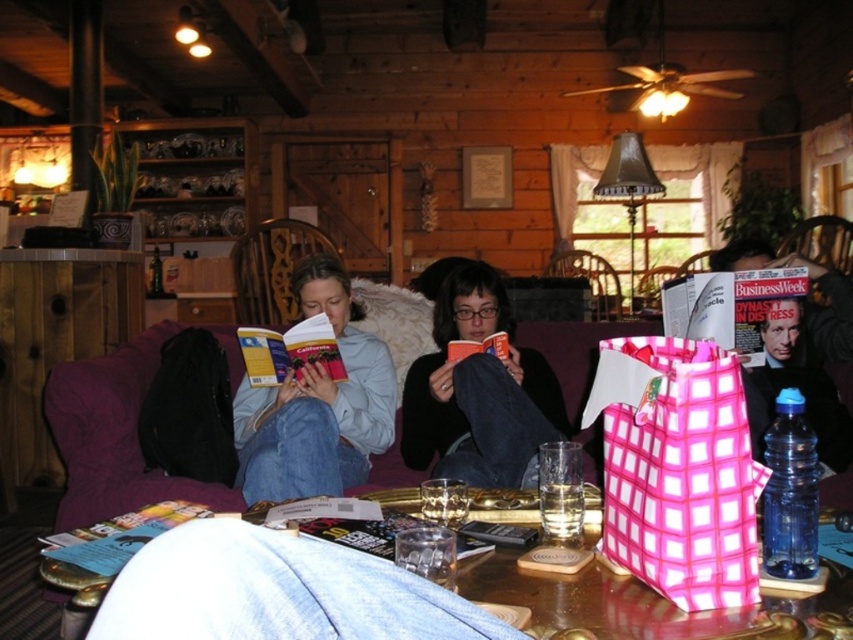
Question: Which object is the closest to the matte paper magazine at center right?

Choices:
 (A) yellow paper book at center
 (B) hardcover book at center
 (C) blue paper book at lower left
 (D) wooden armchair at upper right

Answer: (B)

Question: Which of the following is the closest to the observer?

Choices:
 (A) (212, 513)
 (B) (721, 276)
 (C) (486, 403)
 (D) (450, 342)

Answer: (A)

Question: In this image, where is blue paper book at lower left located relative to hardcover book at center?

Choices:
 (A) above
 (B) below

Answer: (B)

Question: Can you confirm if matte paper magazine at center right is smaller than yellow paper book at center?

Choices:
 (A) yes
 (B) no

Answer: (B)

Question: Which is nearer to the denim jacket at center?

Choices:
 (A) black matte sweater at center
 (B) pink checkered fabric armchair at center

Answer: (A)

Question: Does yellow paper book at center have a greater width compared to wooden armchair at upper right?

Choices:
 (A) no
 (B) yes

Answer: (A)